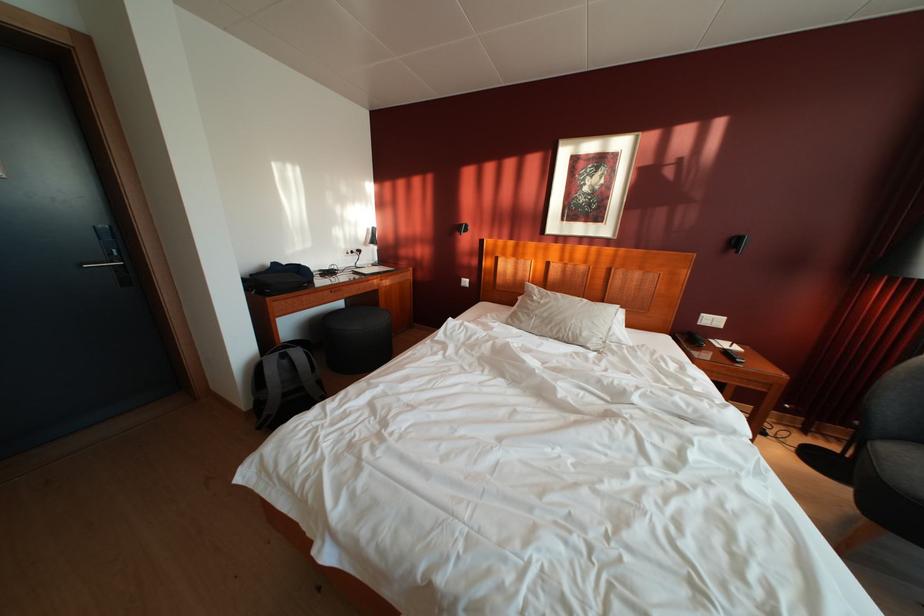
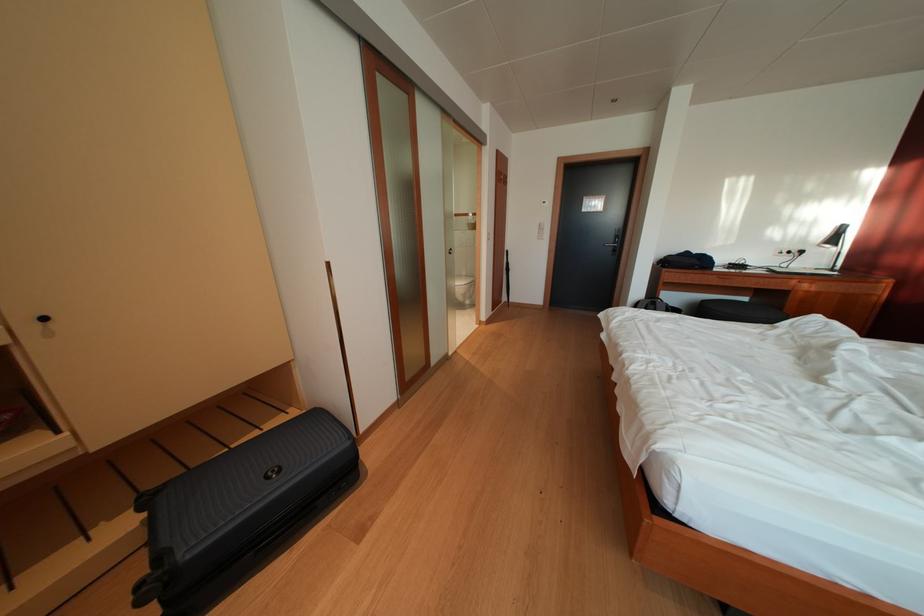
The point at (368,257) is marked in the first image. Where is the corresponding point in the second image?

(809, 257)